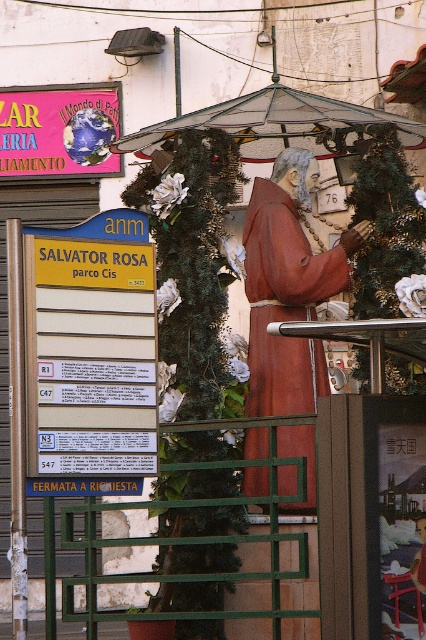
Question: Which point is closer to the camera taking this photo?

Choices:
 (A) (255, 374)
 (B) (20, 109)
 (C) (112, 284)
 (D) (317, 132)

Answer: (C)

Question: Observing the image, what is the correct spatial positioning of stained glass canopy at center in reference to pink paper sign at upper left?

Choices:
 (A) left
 (B) right

Answer: (B)

Question: Is matte brown robe at center to the right of pink paper sign at upper left from the viewer's perspective?

Choices:
 (A) no
 (B) yes

Answer: (B)

Question: Among these points, which one is farthest from the camera?

Choices:
 (A) (348, 150)
 (B) (43, 152)
 (C) (302, 244)
 (D) (143, 404)

Answer: (B)

Question: Based on their relative distances, which object is farther from the yellow plastic sign at center left?

Choices:
 (A) stained glass canopy at center
 (B) pink paper sign at upper left
 (C) matte brown robe at center

Answer: (B)

Question: Does stained glass canopy at center appear on the right side of pink paper sign at upper left?

Choices:
 (A) yes
 (B) no

Answer: (A)